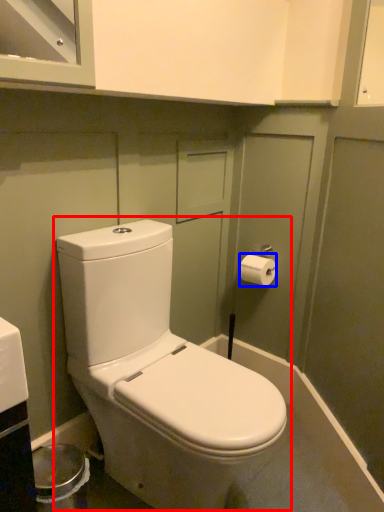
Question: Which object is closer to the camera taking this photo, toilet (highlighted by a red box) or toilet paper (highlighted by a blue box)?

Choices:
 (A) toilet
 (B) toilet paper

Answer: (A)